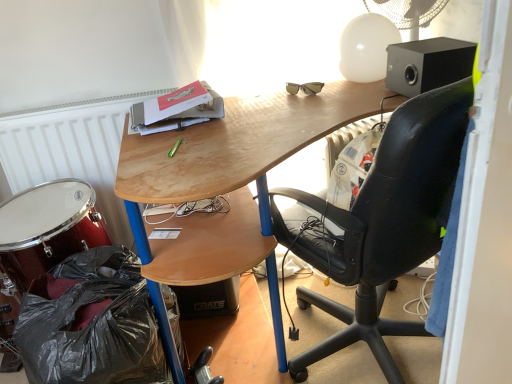
The height and width of the screenshot is (384, 512). In order to click on vacant space situated on the left part of matte black speaker at upper right in this screenshot , I will do `click(364, 90)`.